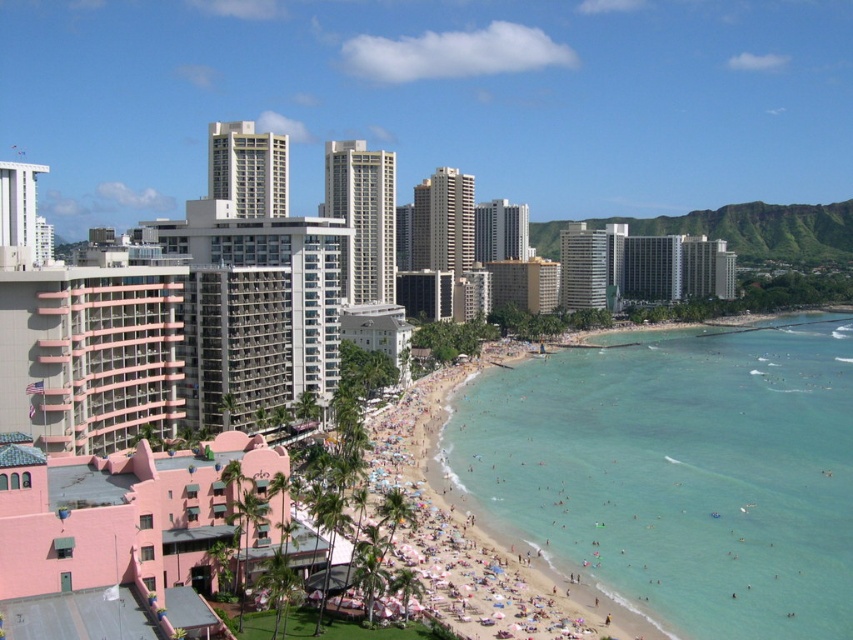
Between point (575, 560) and point (543, 627), which one is positioned behind?

Positioned behind is point (575, 560).

Between clear blue water at beach right and beach sand at center, which one appears on the right side from the viewer's perspective?

clear blue water at beach right

Is point (689, 614) positioned behind point (418, 387)?

No, (689, 614) is closer to viewer.

Find the location of a particular element. This screenshot has height=640, width=853. clear blue water at beach right is located at coordinates (679, 472).

Can you confirm if clear blue water at beach right is thinner than pink concrete building at center?

Yes, clear blue water at beach right is thinner than pink concrete building at center.

Which of these two, clear blue water at beach right or pink concrete building at center, stands taller?

pink concrete building at center is taller.

Between point (753, 397) and point (305, 257), which one is positioned in front?

Point (305, 257)

What are the coordinates of `clear blue water at beach right` in the screenshot? It's located at point(679,472).

Does clear blue water at beach right have a lesser height compared to gray concrete building at center?

Indeed, clear blue water at beach right has a lesser height compared to gray concrete building at center.

Does clear blue water at beach right have a lesser width compared to gray concrete building at center?

No, clear blue water at beach right is not thinner than gray concrete building at center.

Where is `clear blue water at beach right`? clear blue water at beach right is located at coordinates (679, 472).